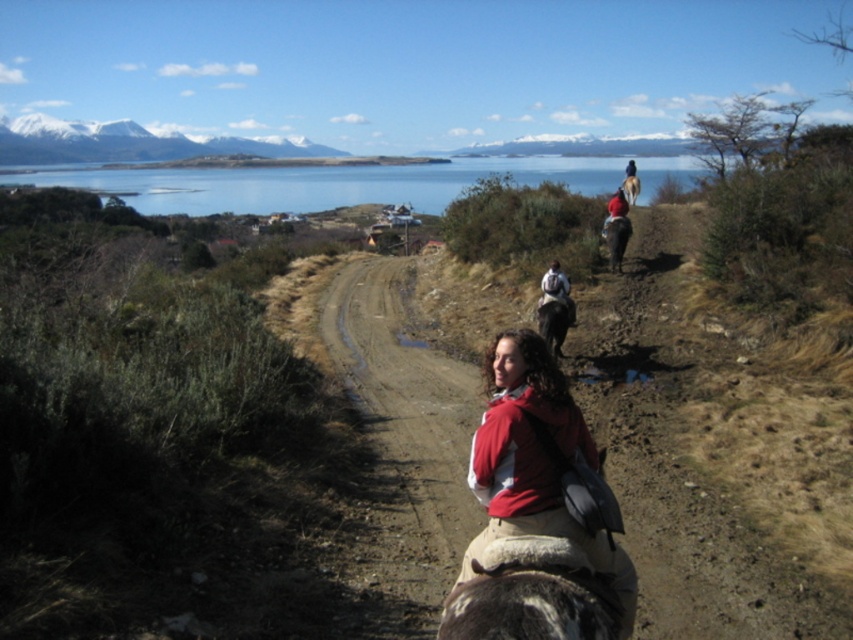
Can you confirm if red fleece jacket at center is positioned to the left of dark brown leather horse at center?

Yes, red fleece jacket at center is to the left of dark brown leather horse at center.

Can you confirm if red fleece jacket at center is smaller than dark brown leather horse at center?

Incorrect, red fleece jacket at center is not smaller in size than dark brown leather horse at center.

Which is behind, point (519, 362) or point (553, 332)?

Point (553, 332)

Locate an element on the screen. red fleece jacket at center is located at coordinates (534, 449).

Can you confirm if matte black backpack at center is positioned below brown glossy horse at center?

Yes.

Is matte black backpack at center to the right of brown glossy horse at center from the viewer's perspective?

In fact, matte black backpack at center is to the left of brown glossy horse at center.

Between point (561, 300) and point (619, 253), which one is positioned behind?

Positioned behind is point (619, 253).

This screenshot has width=853, height=640. Find the location of `matte black backpack at center`. matte black backpack at center is located at coordinates point(556,289).

Is blue water at upper center in front of red fabric jacket at center?

No, blue water at upper center is further to the viewer.

Between point (241, 196) and point (606, 221), which one is positioned in front?

Point (606, 221)

Does point (434, 184) come behind point (612, 220)?

Yes, it is.

This screenshot has height=640, width=853. In order to click on blue water at upper center in this screenshot , I will do [x=318, y=182].